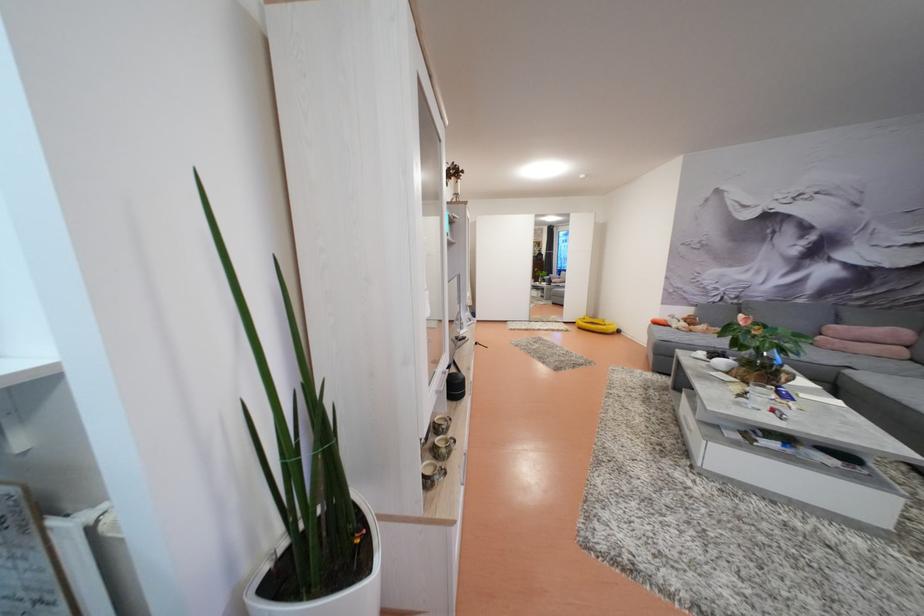
Where would you sit the grey sofa sitting surface? Please return your answer as a coordinate pair (x, y).

(900, 384)